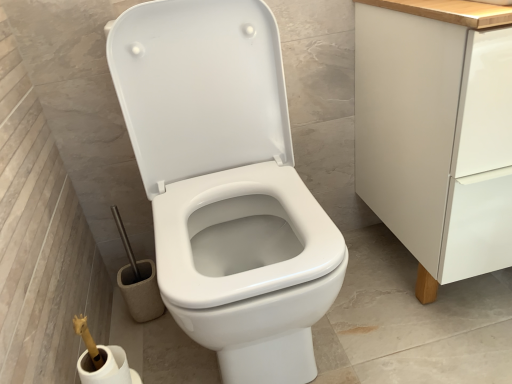
Question: Should I look upward or downward to see white matte toilet paper at lower left?

Choices:
 (A) up
 (B) down

Answer: (B)

Question: Does white glossy toilet at center contain white matte cabinet at right?

Choices:
 (A) yes
 (B) no

Answer: (B)

Question: From a real-world perspective, is white glossy toilet at center located higher than white matte cabinet at right?

Choices:
 (A) no
 (B) yes

Answer: (B)

Question: From the image's perspective, does white glossy toilet at center appear lower than white matte cabinet at right?

Choices:
 (A) yes
 (B) no

Answer: (A)

Question: Is white glossy toilet at center positioned beyond the bounds of white matte cabinet at right?

Choices:
 (A) no
 (B) yes

Answer: (B)

Question: Is white glossy toilet at center wider than white matte cabinet at right?

Choices:
 (A) yes
 (B) no

Answer: (A)

Question: Is white glossy toilet at center smaller than white matte cabinet at right?

Choices:
 (A) no
 (B) yes

Answer: (B)

Question: Considering the relative sizes of white matte cabinet at right and white glossy toilet at center in the image provided, is white matte cabinet at right shorter than white glossy toilet at center?

Choices:
 (A) yes
 (B) no

Answer: (A)

Question: Is white matte cabinet at right behind white glossy toilet at center?

Choices:
 (A) yes
 (B) no

Answer: (A)

Question: From the image's perspective, is white matte cabinet at right on top of white glossy toilet at center?

Choices:
 (A) no
 (B) yes

Answer: (B)

Question: Does white matte cabinet at right appear on the left side of white glossy toilet at center?

Choices:
 (A) no
 (B) yes

Answer: (A)

Question: Is white matte cabinet at right at the right side of white glossy toilet at center?

Choices:
 (A) no
 (B) yes

Answer: (B)

Question: Is white matte cabinet at right looking in the opposite direction of white glossy toilet at center?

Choices:
 (A) no
 (B) yes

Answer: (A)

Question: Considering the relative sizes of white glossy toilet at center and white matte toilet paper at lower left in the image provided, is white glossy toilet at center wider than white matte toilet paper at lower left?

Choices:
 (A) no
 (B) yes

Answer: (B)